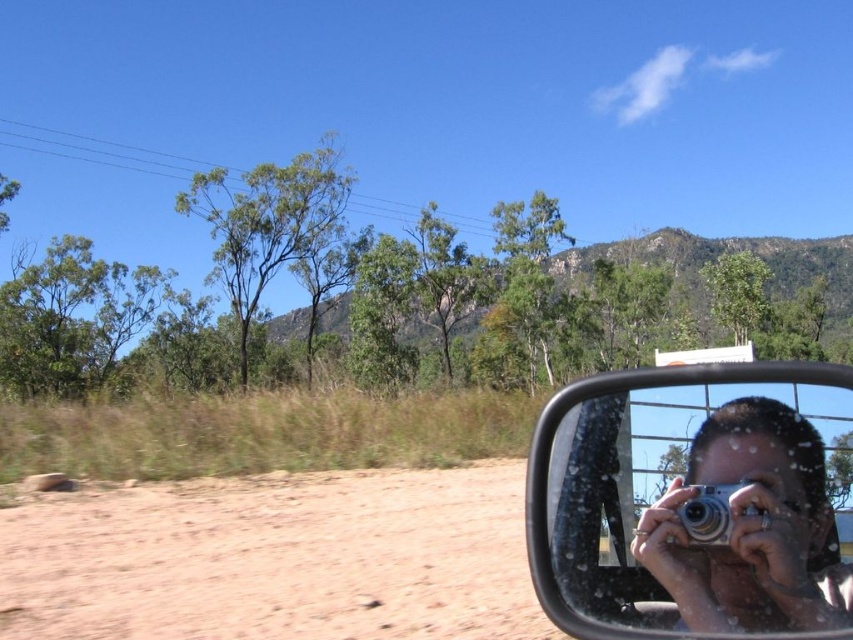
You are sitting in the driver seat of the vehicle and want to adjust the silver metallic mirror at right so that you can see your reflection clearly. Considering the distance between you and the mirror, is it possible to adjust the mirror to achieve a clear reflection?

The silver metallic mirror at right and viewer are 3.72 feet apart, which is a typical distance for adjusting a side mirror. By adjusting the mirror properly, you can achieve a clear reflection.